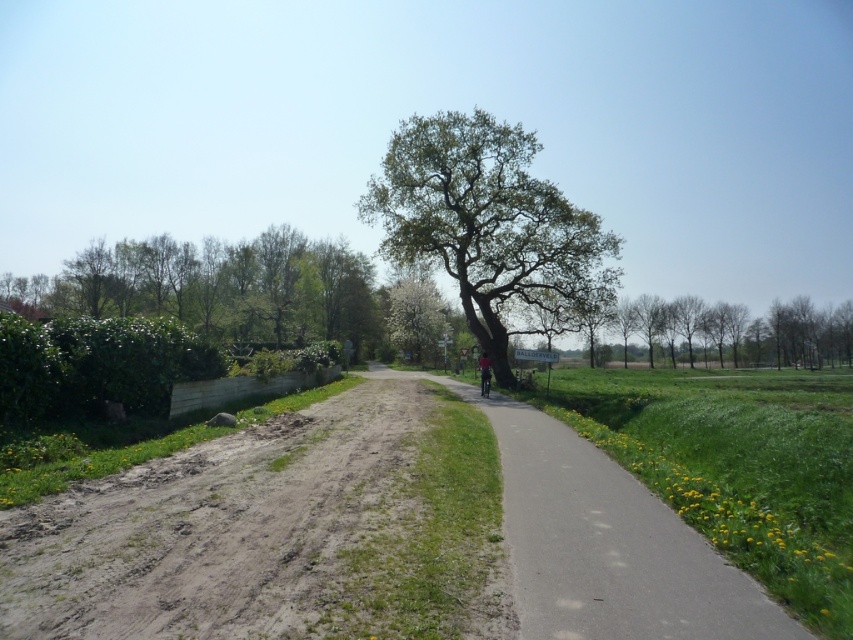
Question: Does asphalt road at center appear over green leafy tree at center?

Choices:
 (A) yes
 (B) no

Answer: (B)

Question: Which point is farther to the camera?

Choices:
 (A) (489, 387)
 (B) (434, 129)
 (C) (146, 540)
 (D) (724, 564)

Answer: (B)

Question: Is brown dirt track at lower left to the right of asphalt road at center from the viewer's perspective?

Choices:
 (A) no
 (B) yes

Answer: (A)

Question: Which point is farther to the camera?

Choices:
 (A) (671, 616)
 (B) (592, 257)
 (C) (486, 380)

Answer: (B)

Question: Does bare branches at right have a lesser width compared to dark red fabric cyclist at center?

Choices:
 (A) no
 (B) yes

Answer: (A)

Question: Which point is farther to the camera?

Choices:
 (A) brown dirt track at lower left
 (B) green leafy tree at center
 (C) asphalt road at center

Answer: (B)